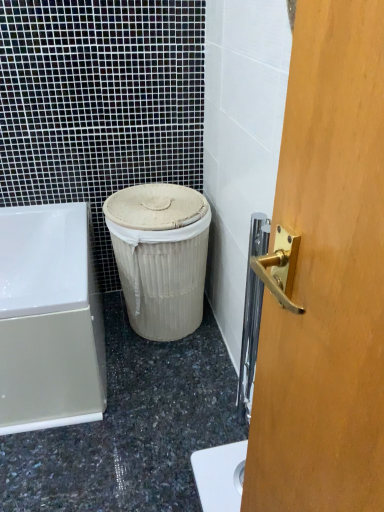
Locate an element on the screen. vacant area on top of beige woven basket at center (from a real-world perspective) is located at coordinates (148, 196).